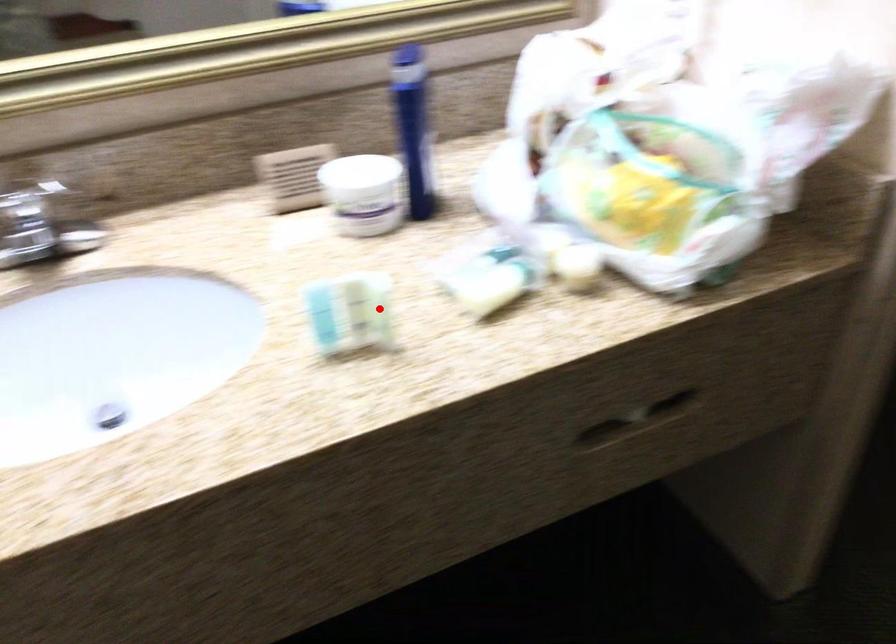
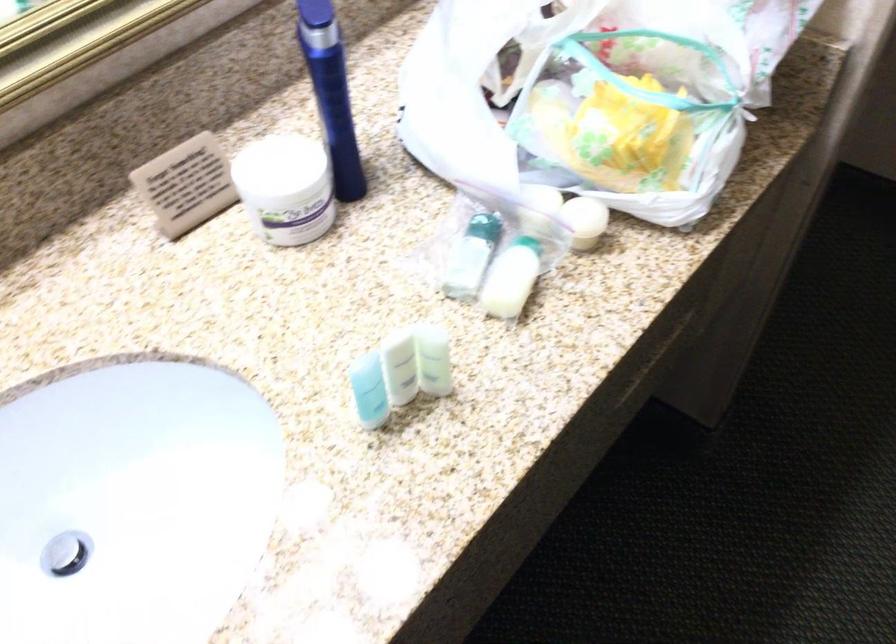
Where in the second image is the point corresponding to the highlighted location from the first image?

(433, 360)